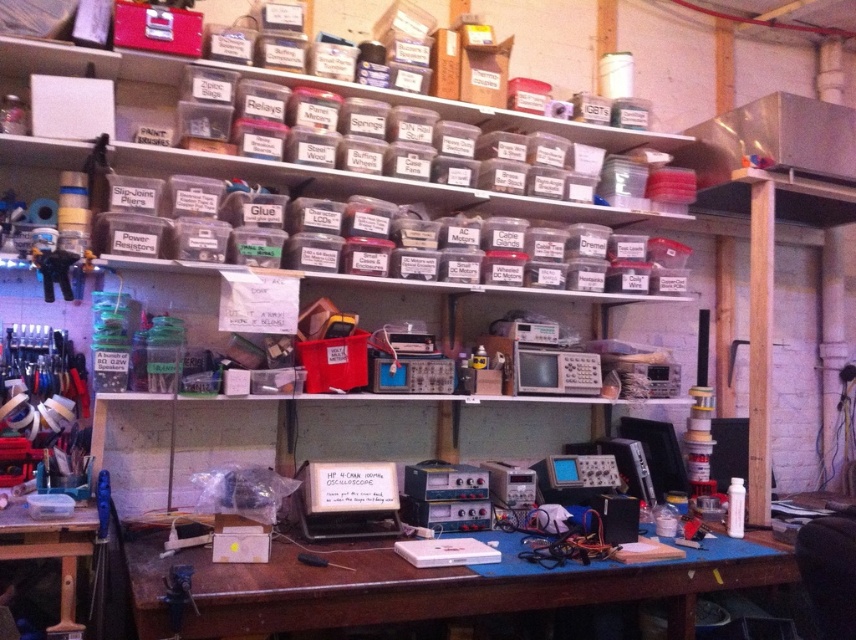
Question: Can you confirm if blue plastic table at lower center is positioned below clear plastic table at lower left?

Choices:
 (A) no
 (B) yes

Answer: (B)

Question: Is blue plastic table at lower center smaller than clear plastic table at lower left?

Choices:
 (A) yes
 (B) no

Answer: (B)

Question: Which of the following is the farthest from the observer?

Choices:
 (A) clear plastic table at lower left
 (B) blue plastic table at lower center

Answer: (A)

Question: Can you confirm if blue plastic table at lower center is bigger than clear plastic table at lower left?

Choices:
 (A) yes
 (B) no

Answer: (A)

Question: Among these objects, which one is farthest from the camera?

Choices:
 (A) blue plastic table at lower center
 (B) clear plastic table at lower left

Answer: (B)

Question: Which of the following is the farthest from the observer?

Choices:
 (A) blue plastic table at lower center
 (B) clear plastic table at lower left

Answer: (B)